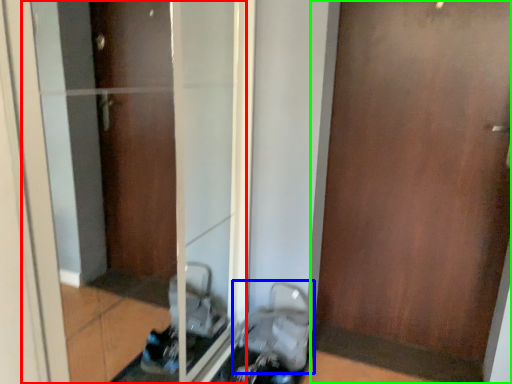
Question: Estimate the real-world distances between objects in this image. Which object is farther from glass door (highlighted by a red box), baby carriage (highlighted by a blue box) or door (highlighted by a green box)?

Choices:
 (A) baby carriage
 (B) door

Answer: (B)